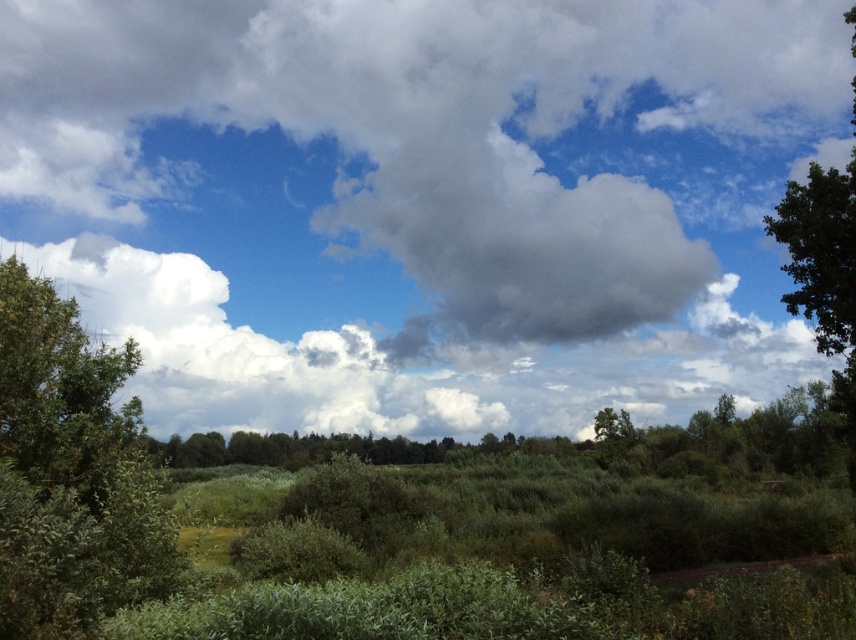
Question: In this image, where is green leafy tree at left located relative to green leafy tree at right?

Choices:
 (A) above
 (B) below

Answer: (B)

Question: Does green leafy tree at left appear on the right side of green leafy tree at right?

Choices:
 (A) yes
 (B) no

Answer: (B)

Question: Observing the image, what is the correct spatial positioning of white fluffy cloud at upper center in reference to green leafy tree at left?

Choices:
 (A) left
 (B) right

Answer: (A)

Question: Which of the following is the farthest from the observer?

Choices:
 (A) (575, 221)
 (B) (9, 358)
 (C) (837, 228)

Answer: (A)

Question: Considering the real-world distances, which object is closest to the green leafy tree at right?

Choices:
 (A) white fluffy cloud at upper center
 (B) green leafy tree at left

Answer: (B)

Question: Which of the following is the farthest from the observer?

Choices:
 (A) white fluffy cloud at upper center
 (B) green leafy tree at left
 (C) green leafy tree at right

Answer: (A)